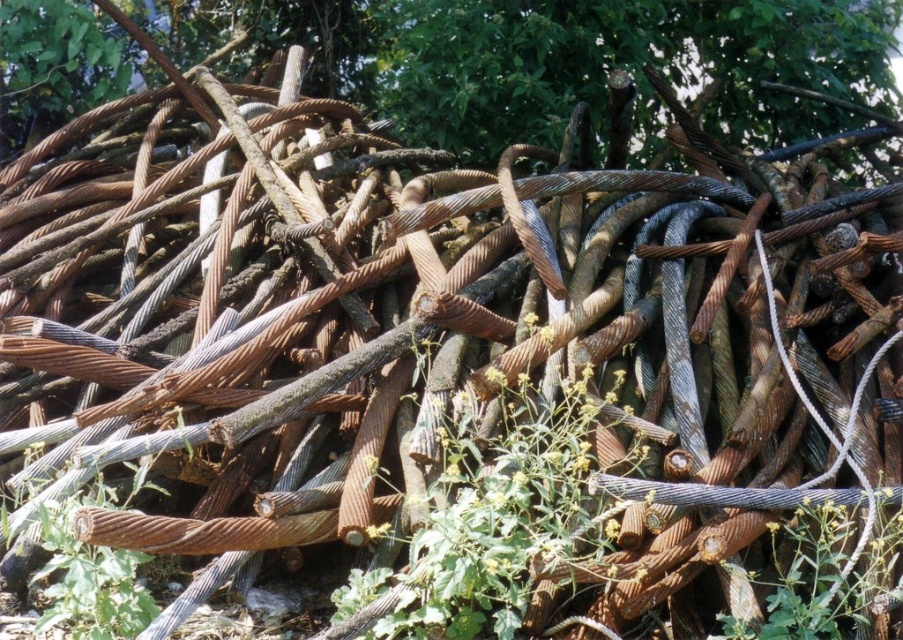
Which is behind, point (475, 108) or point (508, 445)?

Positioned behind is point (475, 108).

Which is below, brown textured wood at upper center or green leafy plant at center?

green leafy plant at center is lower down.

Is point (738, 38) behind point (556, 506)?

That is True.

I want to click on brown textured wood at upper center, so click(548, 54).

Is green leafy plant at center shorter than green leafy weed at center?

In fact, green leafy plant at center may be taller than green leafy weed at center.

Measure the distance between point (455, 608) and camera.

They are 8.90 feet apart.

Where is `green leafy plant at center`? green leafy plant at center is located at coordinates (486, 531).

Can you confirm if brown textured wood at upper center is smaller than green leafy weed at center?

No.

Which is more to the left, brown textured wood at upper center or green leafy weed at center?

brown textured wood at upper center is more to the left.

What do you see at coordinates (548, 54) in the screenshot? This screenshot has width=903, height=640. I see `brown textured wood at upper center` at bounding box center [548, 54].

The width and height of the screenshot is (903, 640). Find the location of `brown textured wood at upper center`. brown textured wood at upper center is located at coordinates (548, 54).